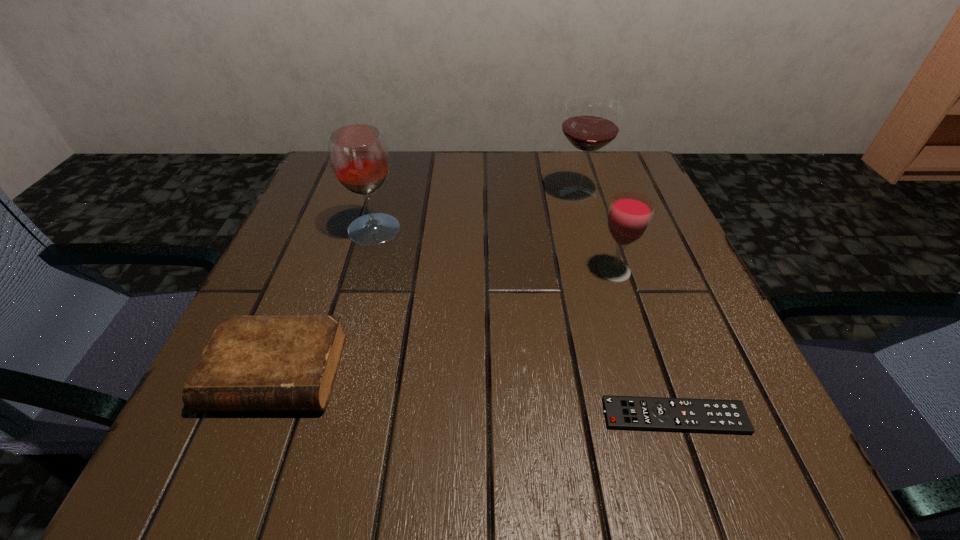
Where is `free space between the second farthest wineglass and the farthest object`? The image size is (960, 540). free space between the second farthest wineglass and the farthest object is located at coordinates (476, 212).

You are a GUI agent. You are given a task and a screenshot of the screen. Output one action in this format:
    pyautogui.click(x=<x>, y=<y>)
    Task: Click on the unoccupied area between the shortest object and the farthest wineglass
    This screenshot has width=960, height=540.
    Given the screenshot: What is the action you would take?
    pyautogui.click(x=626, y=306)

You are a GUI agent. You are given a task and a screenshot of the screen. Output one action in this format:
    pyautogui.click(x=<x>, y=<y>)
    Task: Click on the free space between the second shortest object and the shortest object
    This screenshot has width=960, height=540.
    Given the screenshot: What is the action you would take?
    pyautogui.click(x=475, y=395)

Locate an element on the screen. This screenshot has width=960, height=540. vacant area that lies between the shortest object and the farthest object is located at coordinates [x=626, y=306].

This screenshot has width=960, height=540. In order to click on unoccupied position between the leftmost wineglass and the fourth tallest object in this screenshot , I will do `click(325, 301)`.

I want to click on vacant space that is in between the shortest object and the farthest object, so click(x=626, y=306).

Find the location of a particular element. free area in between the second nearest wineglass and the shortest wineglass is located at coordinates (494, 251).

You are a GUI agent. You are given a task and a screenshot of the screen. Output one action in this format:
    pyautogui.click(x=<x>, y=<y>)
    Task: Click on the object that is the closest to the shortest object
    The image size is (960, 540).
    Given the screenshot: What is the action you would take?
    pyautogui.click(x=629, y=216)

Find the location of `object identified as the second closest to the second farthest wineglass`. object identified as the second closest to the second farthest wineglass is located at coordinates (591, 123).

The height and width of the screenshot is (540, 960). In order to click on wineglass that is the closest to the second shortest object in this screenshot , I will do point(359,159).